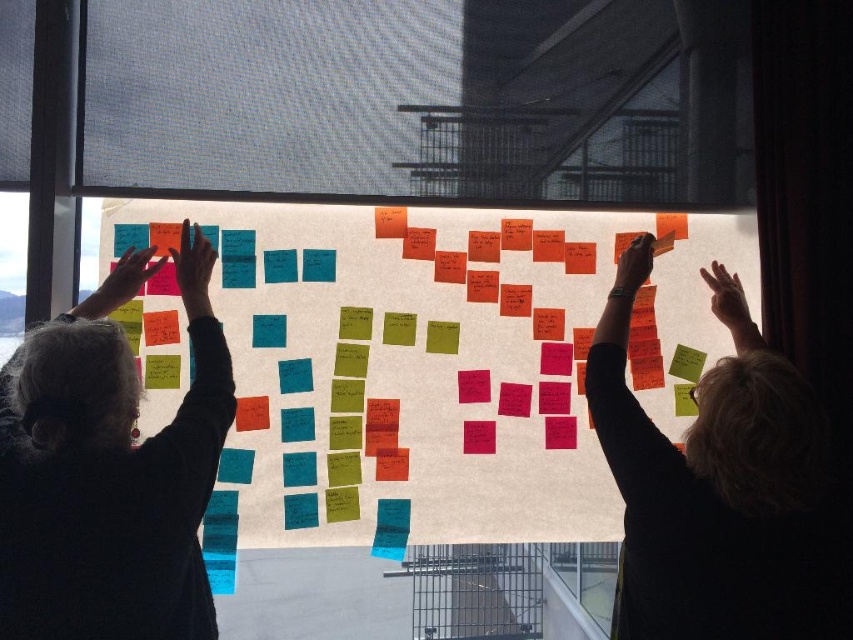
Question: Which of the following is the closest to the observer?

Choices:
 (A) (123, 260)
 (B) (229, 355)
 (C) (643, 468)

Answer: (C)

Question: Among these points, which one is farthest from the camera?

Choices:
 (A) (97, 305)
 (B) (215, 253)
 (C) (712, 273)

Answer: (C)

Question: Which object is farther from the camera taking this photo?

Choices:
 (A) smooth black shirt at upper right
 (B) matte black sweater at left
 (C) matte blue sticky note at upper left

Answer: (C)

Question: Can you confirm if matte plastic hand at upper left is positioned below matte black hand at upper right?

Choices:
 (A) yes
 (B) no

Answer: (A)

Question: Can you confirm if matte black sweater at left is positioned above matte plastic hand at upper left?

Choices:
 (A) yes
 (B) no

Answer: (B)

Question: Where is smooth black shirt at upper right located in relation to matte black sweater at left in the image?

Choices:
 (A) right
 (B) left

Answer: (A)